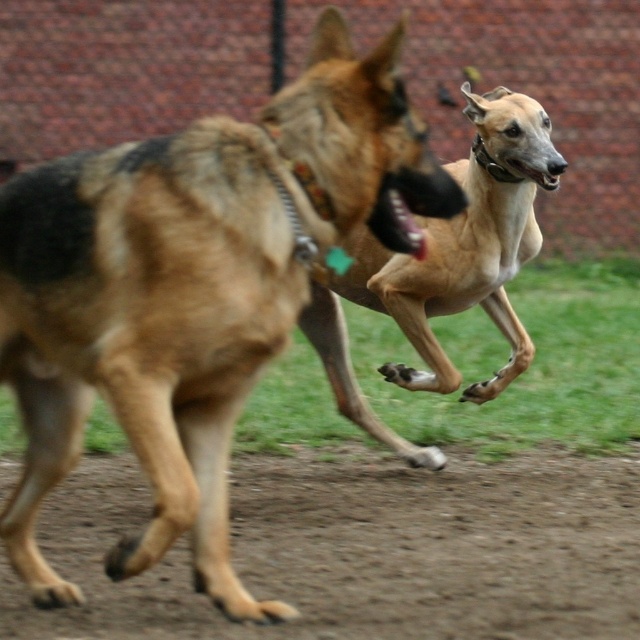
You are a photographer trying to capture a photo of the brown fur dog at center and the brown dirt track at lower center in the same frame. The minimum distance your camera can focus on two objects simultaneously is 1.2 meters. Can you take the photo without moving your camera?

The brown fur dog at center and brown dirt track at lower center are 1.14 meters apart from each other, which is less than the camera minimum focus distance of 1.2 meters. So yes, you can take the photo without moving your camera.

You are a photographer trying to capture both dogs in the image. The German Shepherd is in the foreground, and the brown fur dog at center is positioned at coordinates 0.455, 0.300. To ensure both are in focus, where should you focus your camera?

The brown fur dog at center is located at point (192, 291), so you should focus your camera at that point to ensure both dogs are in focus.

You are standing in front of the image and want to determine which of the two points, point (188,586) or point (401,224), is closer to you. Which one is closer?

Point (188,586) is closer to you because it is further to the viewer than point (401,224).